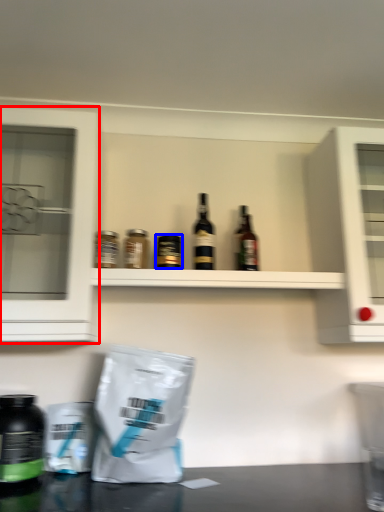
Question: Among these objects, which one is nearest to the camera, cabinetry (highlighted by a red box) or bottle (highlighted by a blue box)?

Choices:
 (A) cabinetry
 (B) bottle

Answer: (A)